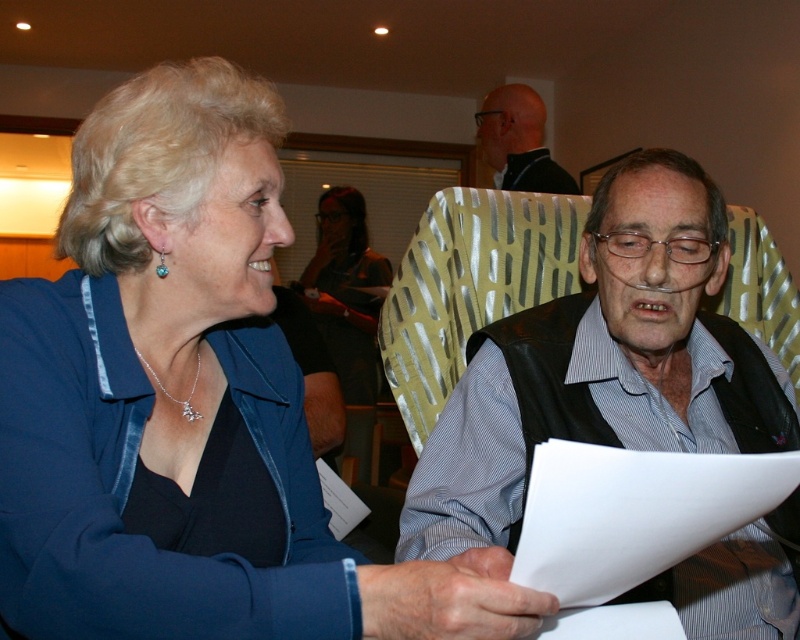
Question: Which point is closer to the camera taking this photo?

Choices:
 (A) (604, 202)
 (B) (345, 209)
 (C) (520, 106)
 (D) (46, 417)

Answer: (D)

Question: Which object is closer to the camera taking this photo?

Choices:
 (A) matte black jacket at center
 (B) matte black vest at center
 (C) blue fabric at center

Answer: (C)

Question: Is blue fabric at center smaller than matte black shirt at upper center?

Choices:
 (A) no
 (B) yes

Answer: (A)

Question: Where is matte black jacket at center located in relation to matte black shirt at upper center in the image?

Choices:
 (A) left
 (B) right

Answer: (A)

Question: Which object appears closest to the camera in this image?

Choices:
 (A) matte black shirt at upper center
 (B) matte black vest at center

Answer: (B)

Question: Is blue fabric at center bigger than matte black shirt at upper center?

Choices:
 (A) yes
 (B) no

Answer: (A)